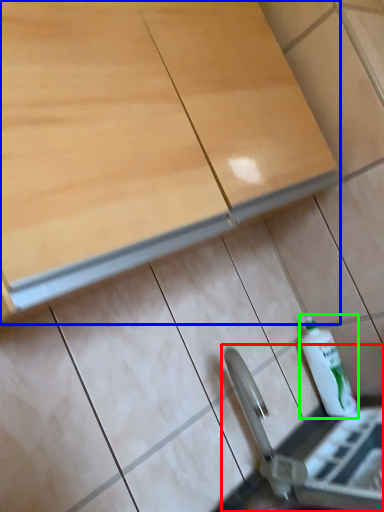
Question: Considering the real-world distances, which object is farthest from sink (highlighted by a red box)? cabinetry (highlighted by a blue box) or bottle (highlighted by a green box)?

Choices:
 (A) cabinetry
 (B) bottle

Answer: (A)